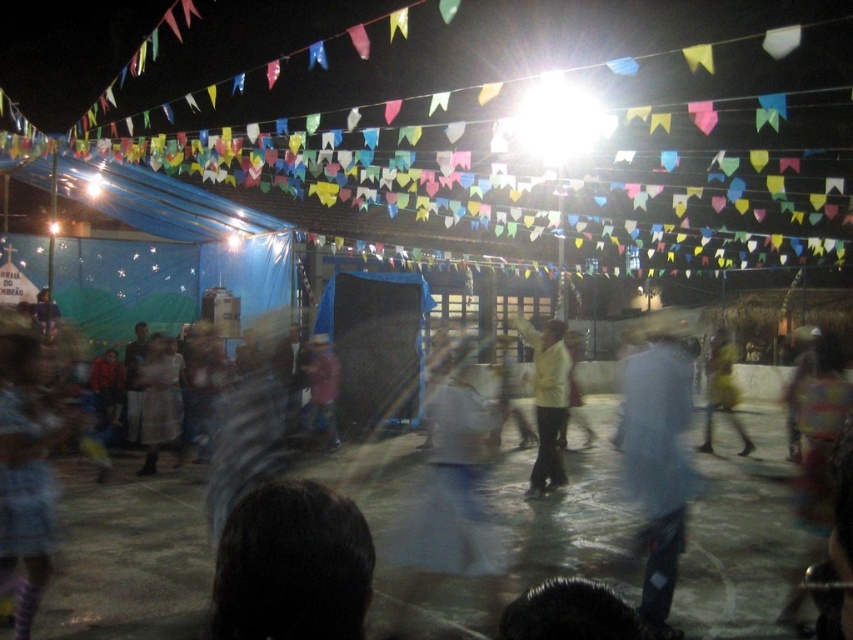
Which of these two, white matte shirt at center or matte white dress at center, stands shorter?

With less height is matte white dress at center.

Between white matte shirt at center and matte white dress at center, which one is positioned higher?

Positioned higher is white matte shirt at center.

You are a GUI agent. You are given a task and a screenshot of the screen. Output one action in this format:
    pyautogui.click(x=<x>, y=<y>)
    Task: Click on the white matte shirt at center
    Image resolution: width=853 pixels, height=640 pixels.
    Given the screenshot: What is the action you would take?
    pyautogui.click(x=547, y=400)

Locate an element on the screen. This screenshot has width=853, height=640. white matte shirt at center is located at coordinates (547, 400).

Does white matte shirt at center have a smaller size compared to reddish-brown fabric at center?

Actually, white matte shirt at center might be larger than reddish-brown fabric at center.

Which is below, white matte shirt at center or reddish-brown fabric at center?

Positioned lower is reddish-brown fabric at center.

Is point (538, 458) more distant than point (328, 349)?

No, (538, 458) is in front of (328, 349).

The height and width of the screenshot is (640, 853). Identify the location of white matte shirt at center. click(547, 400).

Between light blue fabric at center and reddish-brown fabric at center, which one is positioned lower?

Positioned lower is reddish-brown fabric at center.

Locate an element on the screen. The image size is (853, 640). light blue fabric at center is located at coordinates (657, 464).

In order to click on light blue fabric at center in this screenshot , I will do `click(657, 464)`.

Locate an element on the screen. This screenshot has width=853, height=640. light blue fabric at center is located at coordinates pyautogui.click(x=657, y=464).